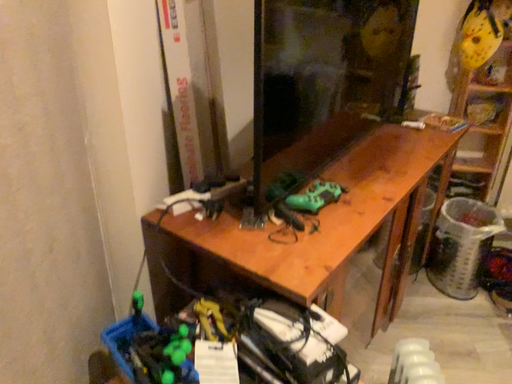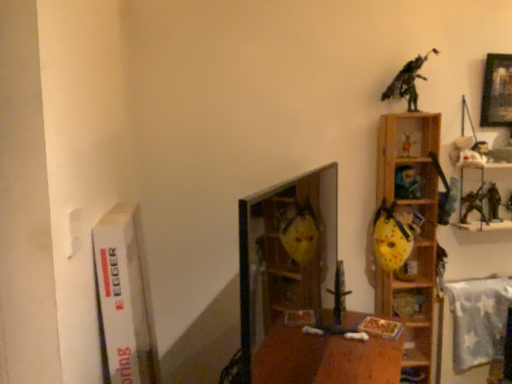
Question: How did the camera likely rotate when shooting the video?

Choices:
 (A) rotated left
 (B) rotated right

Answer: (B)